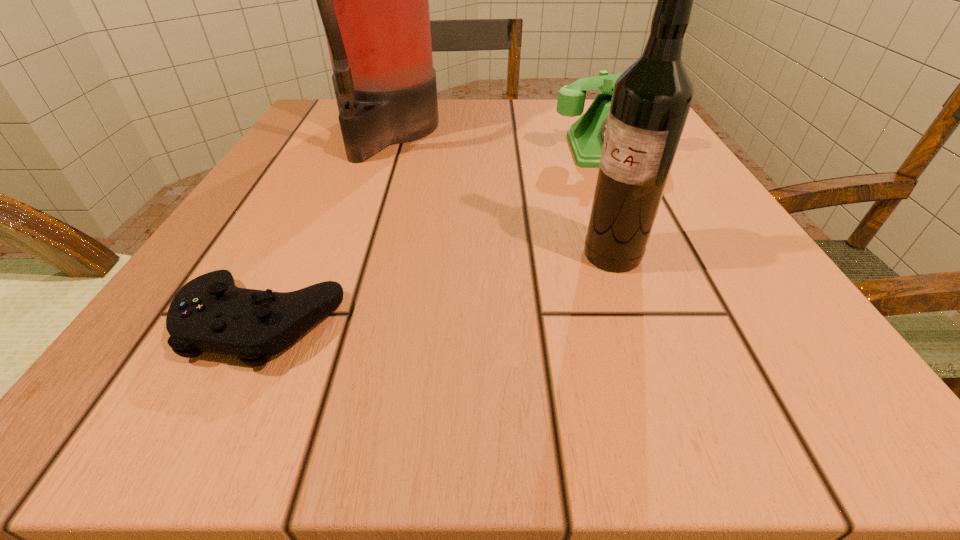
Image resolution: width=960 pixels, height=540 pixels. Identify the location of empty space that is in between the control and the fire extinguisher. (324, 227).

In order to click on free space between the telephone and the tallest object in this screenshot , I will do pos(499,141).

This screenshot has width=960, height=540. In order to click on free area in between the control and the tallest object in this screenshot , I will do `click(324, 227)`.

At what (x,y) coordinates should I click in order to perform the action: click on free space between the fire extinguisher and the telephone. Please return your answer as a coordinate pair (x, y). The image size is (960, 540). Looking at the image, I should click on (499, 141).

Find the location of `vacant space that is in between the control and the telephone`. vacant space that is in between the control and the telephone is located at coordinates (436, 236).

Identify the location of unoccupied position between the control and the tallest object. The height and width of the screenshot is (540, 960). (324, 227).

At what (x,y) coordinates should I click in order to perform the action: click on free space between the fire extinguisher and the control. Please return your answer as a coordinate pair (x, y). Looking at the image, I should click on (324, 227).

Select which object appears as the closest to the third tallest object. Please provide its 2D coordinates. Your answer should be formatted as a tuple, i.e. [(x, y)], where the tuple contains the x and y coordinates of a point satisfying the conditions above.

[(651, 100)]

The height and width of the screenshot is (540, 960). I want to click on object that is the third closest to the wine bottle, so click(373, 0).

Where is `free spot that satisfies the following two spatial constraints: 1. on the dial of the telephone; 2. on the front and back of the wine bottle`? The image size is (960, 540). free spot that satisfies the following two spatial constraints: 1. on the dial of the telephone; 2. on the front and back of the wine bottle is located at coordinates pos(660,255).